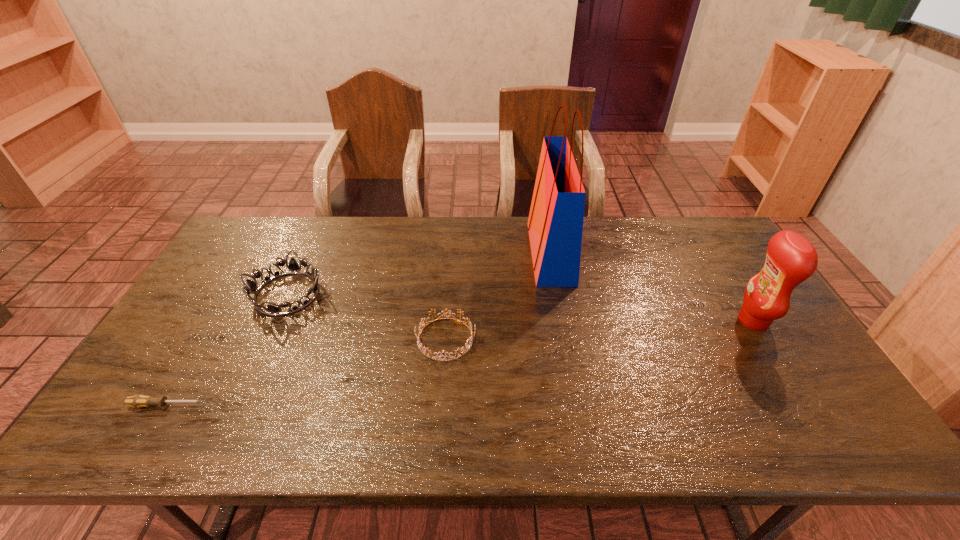
This screenshot has width=960, height=540. Identify the location of the tallest object. (555, 224).

Where is `the fourth object from left to right`? The height and width of the screenshot is (540, 960). the fourth object from left to right is located at coordinates click(x=555, y=224).

What are the coordinates of `the rightmost object` in the screenshot? It's located at (791, 259).

Where is `condiment`? Image resolution: width=960 pixels, height=540 pixels. condiment is located at coordinates (791, 259).

The width and height of the screenshot is (960, 540). Identify the location of the third shortest object. (293, 266).

Locate an element on the screen. the taller tiara is located at coordinates (293, 266).

Where is `the second shortest object`? the second shortest object is located at coordinates (425, 350).

You are a GUI agent. You are given a task and a screenshot of the screen. Output one action in this format:
    pyautogui.click(x=<x>, y=<y>)
    Task: Click on the third object from left to right
    This screenshot has width=960, height=540.
    Given the screenshot: What is the action you would take?
    pyautogui.click(x=425, y=350)

Find the location of a particular element. This screenshot has height=540, width=960. screwdriver is located at coordinates (138, 401).

Find the location of a particular element. The height and width of the screenshot is (540, 960). the shortest object is located at coordinates (138, 401).